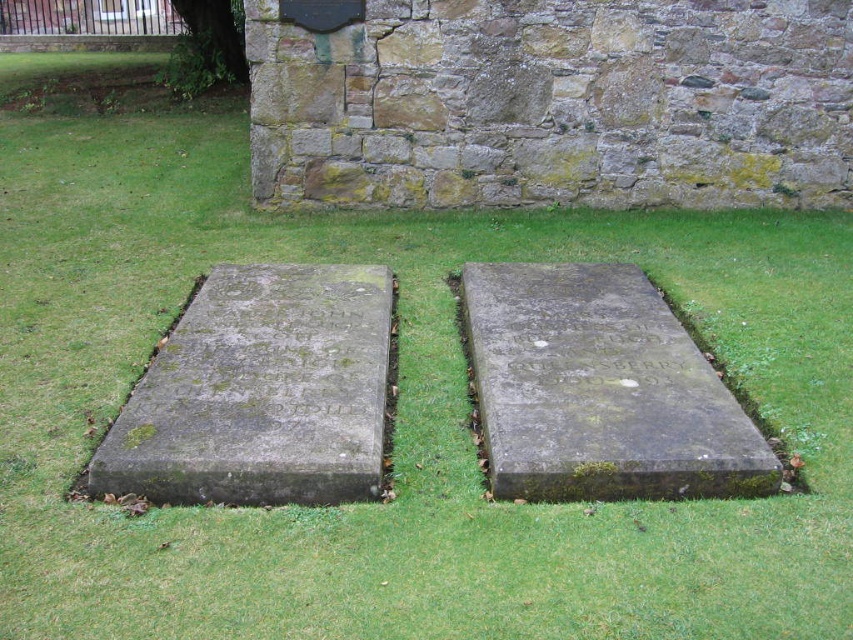
Question: Considering the relative positions of green mossy concrete at left and green mossy stone at center in the image provided, where is green mossy concrete at left located with respect to green mossy stone at center?

Choices:
 (A) right
 (B) left

Answer: (B)

Question: Is green mossy concrete at left thinner than green mossy stone at center?

Choices:
 (A) yes
 (B) no

Answer: (B)

Question: Where is green mossy concrete at left located in relation to green mossy stone at center in the image?

Choices:
 (A) left
 (B) right

Answer: (A)